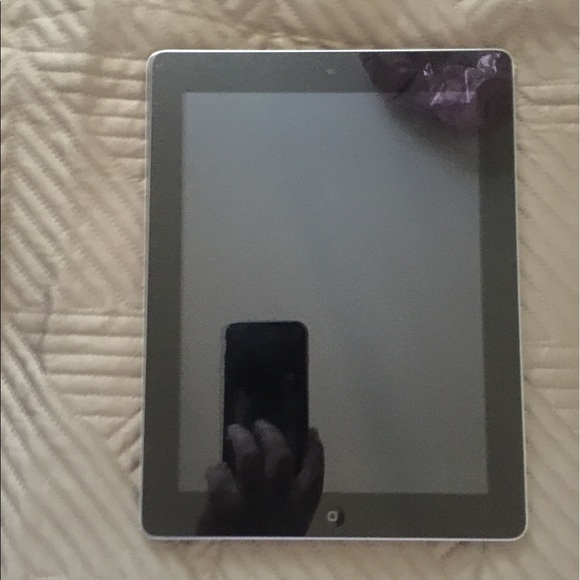
Find the location of `phone`. phone is located at coordinates (251, 397).